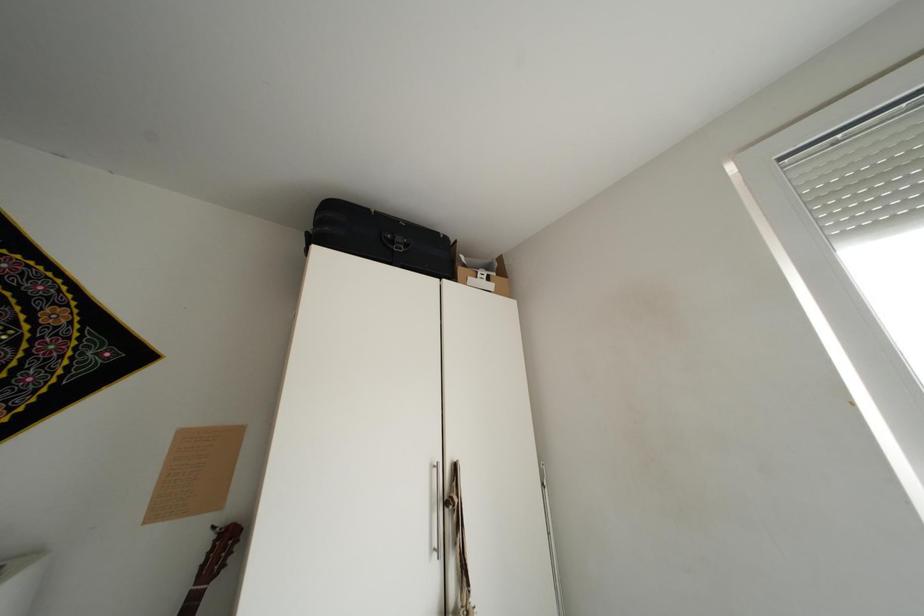
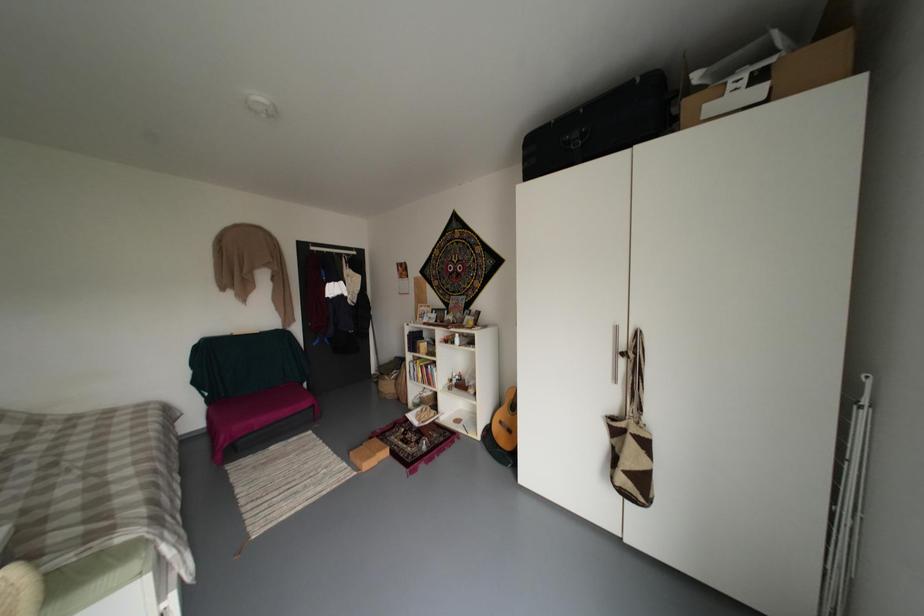
Question: The images are taken continuously from a first-person perspective. In which direction is your viewpoint rotating?

Choices:
 (A) Left
 (B) Right
 (C) Up
 (D) Down

Answer: (A)